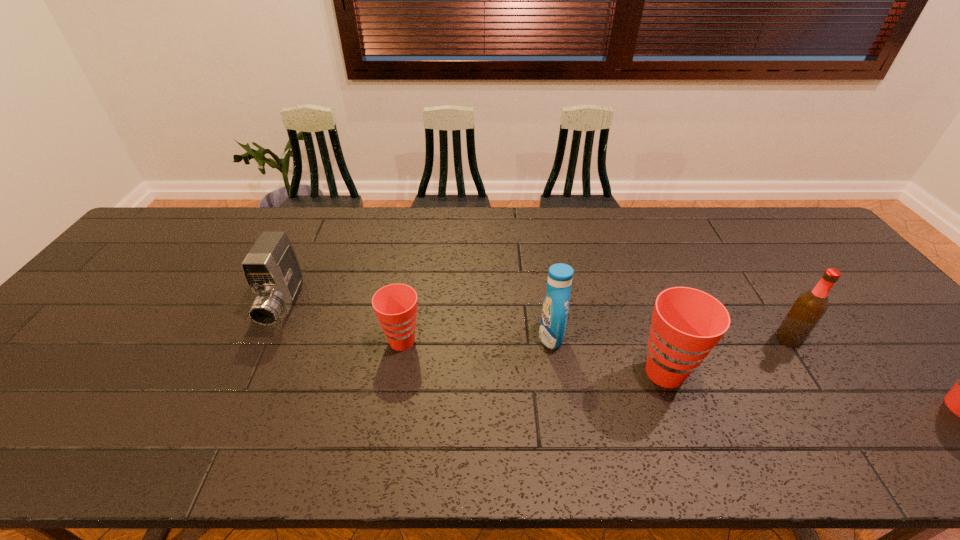
You are a GUI agent. You are given a task and a screenshot of the screen. Output one action in this format:
    pyautogui.click(x=<x>, y=<y>)
    Task: Click on the empty space between the taller cup and the leftmost object
    Image resolution: width=960 pixels, height=540 pixels.
    Given the screenshot: What is the action you would take?
    pyautogui.click(x=474, y=339)

Where is `vacant region between the taller cup and the fourth object from right to left`? vacant region between the taller cup and the fourth object from right to left is located at coordinates (534, 356).

Locate an element on the screen. The height and width of the screenshot is (540, 960). free space between the shortest object and the beer bottle is located at coordinates (595, 340).

Choose which object is the nearest neighbor to the third object from left to right. Please provide its 2D coordinates. Your answer should be formatted as a tuple, i.e. [(x, y)], where the tuple contains the x and y coordinates of a point satisfying the conditions above.

[(687, 323)]

Where is `the third closest object to the beer bottle`? The width and height of the screenshot is (960, 540). the third closest object to the beer bottle is located at coordinates (395, 305).

Locate an element on the screen. This screenshot has width=960, height=540. cup object that ranks as the second closest to the detergent is located at coordinates (395, 305).

Where is `free spot that satisfies the following two spatial constraints: 1. at the front of the beer bottle, highlighting the lens; 2. on the left side of the leftmost object`? free spot that satisfies the following two spatial constraints: 1. at the front of the beer bottle, highlighting the lens; 2. on the left side of the leftmost object is located at coordinates (269, 339).

Find the location of a particular element. vacant position in the image that satisfies the following two spatial constraints: 1. on the front-facing side of the beer bottle; 2. on the left side of the detergent is located at coordinates (551, 339).

I want to click on free space that satisfies the following two spatial constraints: 1. at the front of the camcorder, highlighting the lens; 2. on the right side of the beer bottle, so click(269, 339).

Where is `vacant space that satisfies the following two spatial constraints: 1. at the front of the shorter cup, highlighting the lens; 2. on the right side of the leftmost object`? Image resolution: width=960 pixels, height=540 pixels. vacant space that satisfies the following two spatial constraints: 1. at the front of the shorter cup, highlighting the lens; 2. on the right side of the leftmost object is located at coordinates (268, 341).